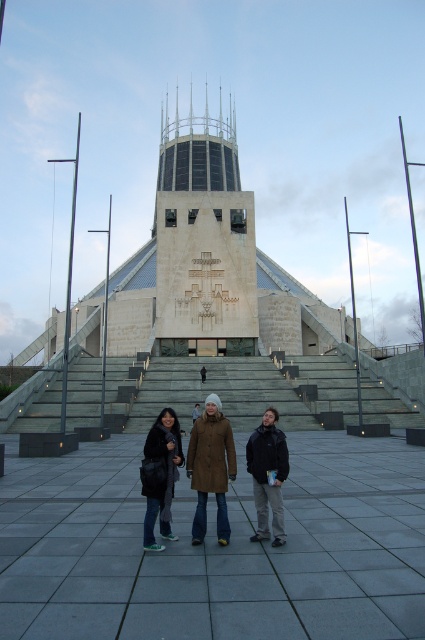
Does gray concrete stairs at center have a greater height compared to brown leather jacket at center?

Yes, gray concrete stairs at center is taller than brown leather jacket at center.

Is gray concrete stairs at center wider than brown leather jacket at center?

Yes.

Between point (329, 397) and point (206, 436), which one is positioned behind?

The point (329, 397) is more distant.

Identify the location of gray concrete stairs at center. (218, 392).

Is brown leather jacket at center below black matte jacket at lower center?

No, brown leather jacket at center is not below black matte jacket at lower center.

Between point (201, 480) and point (283, 442), which one is positioned in front?

Point (201, 480) is more forward.

You are a GUI agent. You are given a task and a screenshot of the screen. Output one action in this format:
    pyautogui.click(x=<x>, y=<y>)
    Task: Click on the brown leather jacket at center
    The width and height of the screenshot is (425, 640).
    Given the screenshot: What is the action you would take?
    pyautogui.click(x=210, y=468)

Does brown leather jacket at center have a larger size compared to dark brown fur coat at lower center?

Indeed, brown leather jacket at center has a larger size compared to dark brown fur coat at lower center.

Which is behind, point (217, 419) or point (146, 536)?

The point (217, 419) is behind.

Where is `brown leather jacket at center`? This screenshot has height=640, width=425. brown leather jacket at center is located at coordinates (210, 468).

The height and width of the screenshot is (640, 425). Find the location of `brown leather jacket at center`. brown leather jacket at center is located at coordinates (210, 468).